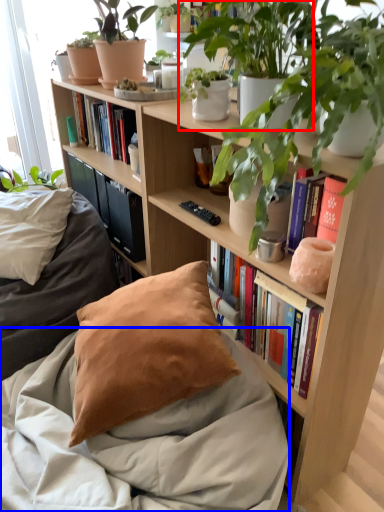
Question: Among these objects, which one is nearest to the camera, houseplant (highlighted by a red box) or blanket (highlighted by a blue box)?

Choices:
 (A) houseplant
 (B) blanket

Answer: (B)